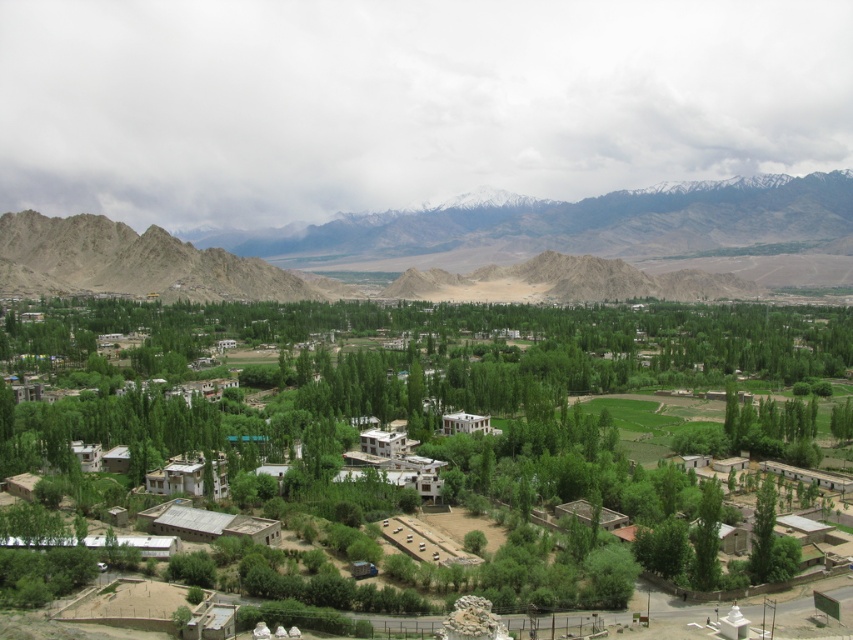
Question: Can you confirm if green leafy tree at center is positioned to the left of rugged brown mountains at upper center?

Choices:
 (A) yes
 (B) no

Answer: (A)

Question: From the image, what is the correct spatial relationship of green leafy tree at center in relation to rugged brown mountains at upper center?

Choices:
 (A) above
 (B) below

Answer: (B)

Question: Which point appears closest to the camera in this image?

Choices:
 (A) (144, 259)
 (B) (141, 429)

Answer: (B)

Question: Does green leafy tree at center have a greater width compared to rugged brown mountains at upper center?

Choices:
 (A) no
 (B) yes

Answer: (A)